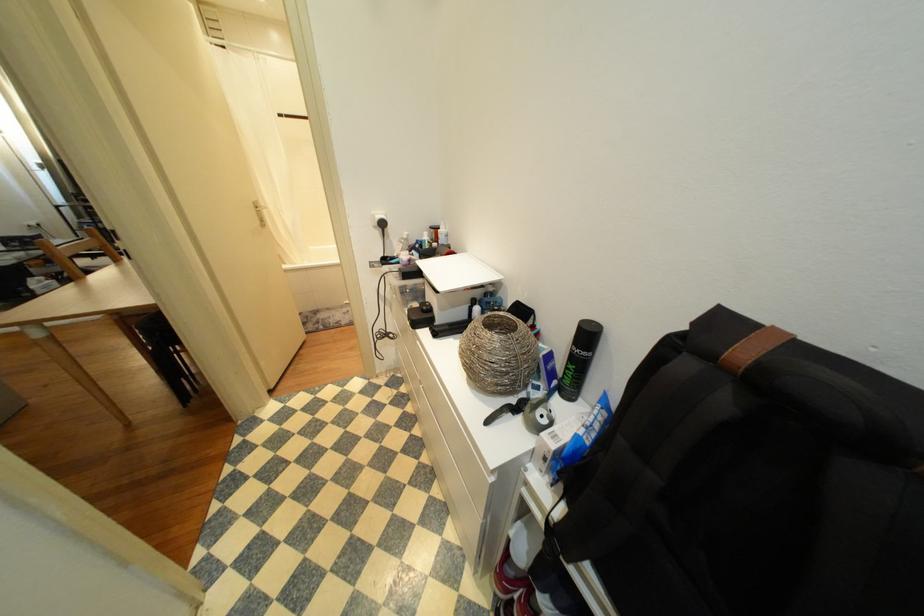
The location [497,354] corresponds to which object?

This point indicates the woven spherical vase.